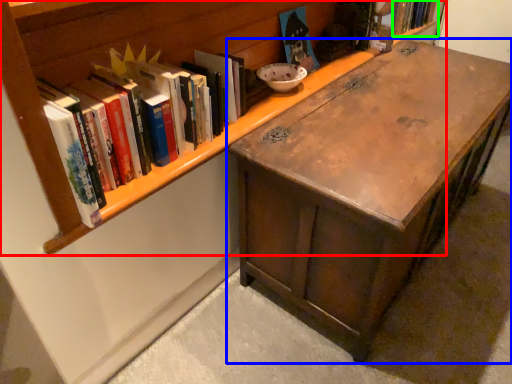
Question: Which object is the closest to the bookcase (highlighted by a red box)? Choose among these: desk (highlighted by a blue box) or book (highlighted by a green box).

Choices:
 (A) desk
 (B) book

Answer: (A)